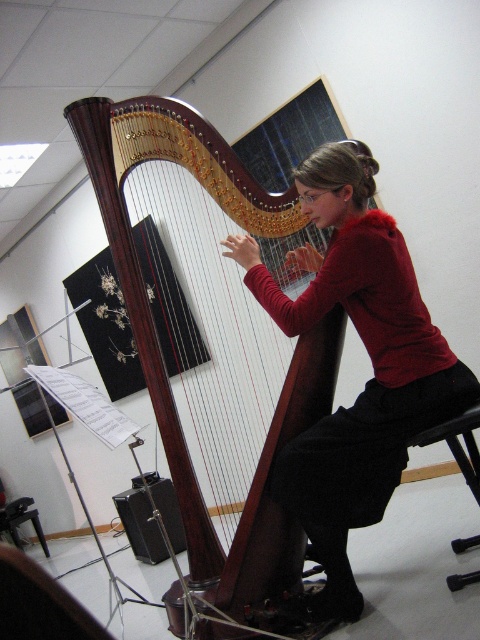
You are standing in the music room and want to place a small plant on the wooden harp at center. The harp is located at coordinates point 0.534, 0.440. Can you confirm the exact position to place the plant?

The wooden harp at center is located at point (211,340), so place the plant there.

In the scene shown: You are a photographer standing in front of the wooden harp at center. You want to take a photo of it but need to ensure you are within the 3.5 meters safety distance rule for the event. Are you within the required distance?

The wooden harp at center is 3.22 meters from camera, which is within the 3.5 meters safety distance rule, so you are within the required distance.

You are a photographer setting up a shoot in the music room. You want to place a small lamp between the matte red sweater at center and the black plastic stool at lower right. Based on their positions, where should the lamp be placed?

The lamp should be placed between the matte red sweater at center and the black plastic stool at lower right, as the matte red sweater at center is located above the black plastic stool at lower right, so placing the lamp in the space between them would work.